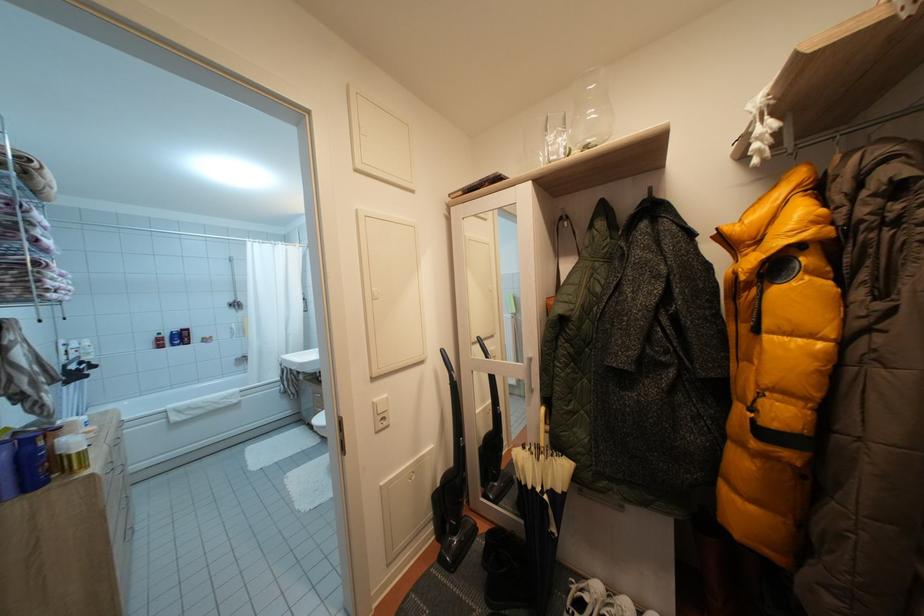
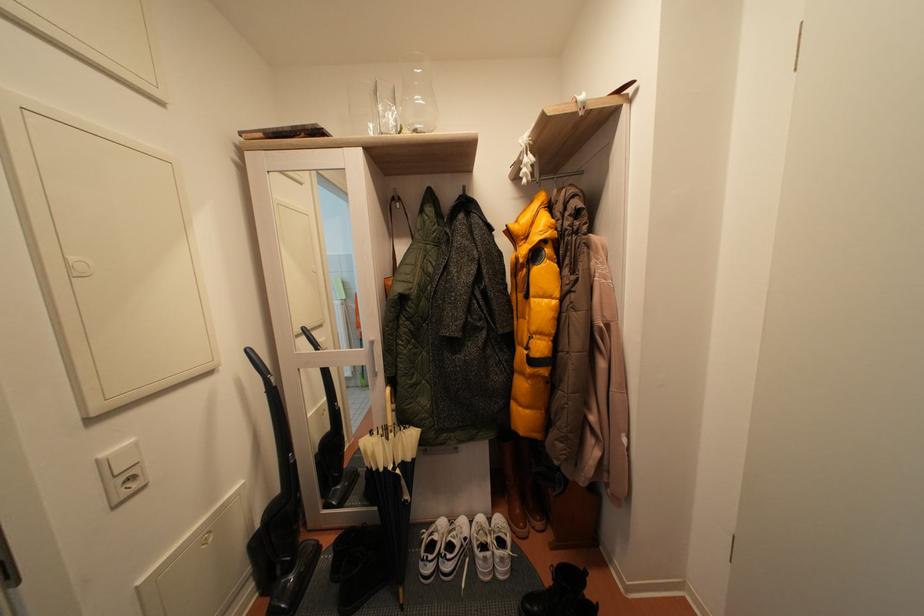
The point at (541, 454) is marked in the first image. Where is the corresponding point in the second image?

(387, 437)